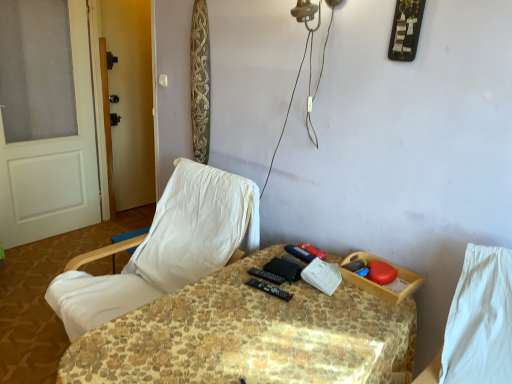
Question: In the image, is black plastic remote control at center positioned in front of or behind transparent glass screen door at left?

Choices:
 (A) front
 (B) behind

Answer: (A)

Question: Considering the positions of black plastic remote control at center and transparent glass screen door at left in the image, is black plastic remote control at center taller or shorter than transparent glass screen door at left?

Choices:
 (A) short
 (B) tall

Answer: (A)

Question: Which object is positioned closest to the white fabric chair at left?

Choices:
 (A) transparent glass screen door at left
 (B) white painted wood door at left
 (C) black plastic remote control at center
 (D) patterned fabric table at center

Answer: (D)

Question: Estimate the real-world distances between objects in this image. Which object is closer to the black plastic remote control at center?

Choices:
 (A) transparent glass screen door at left
 (B) patterned fabric table at center
 (C) white painted wood door at left
 (D) white fabric chair at left

Answer: (B)